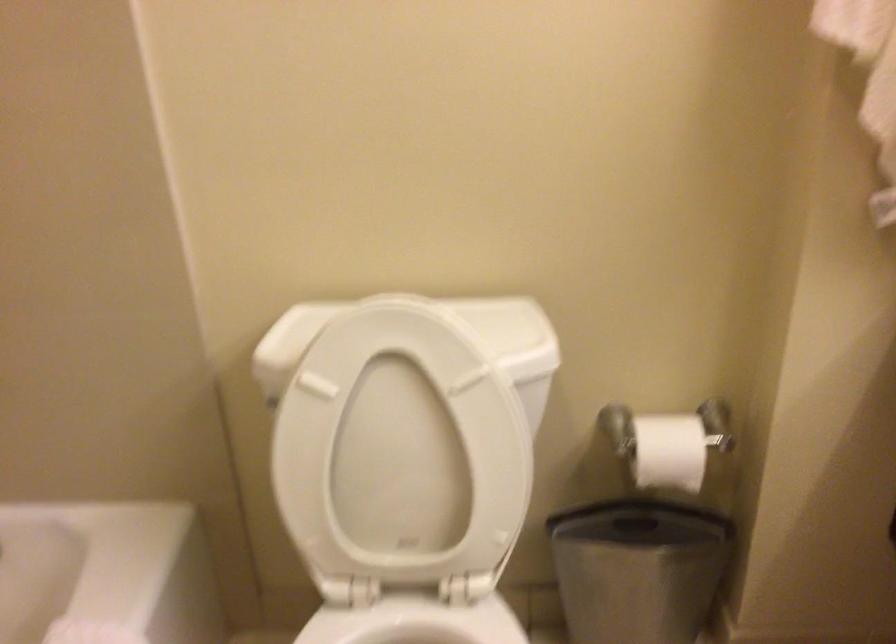
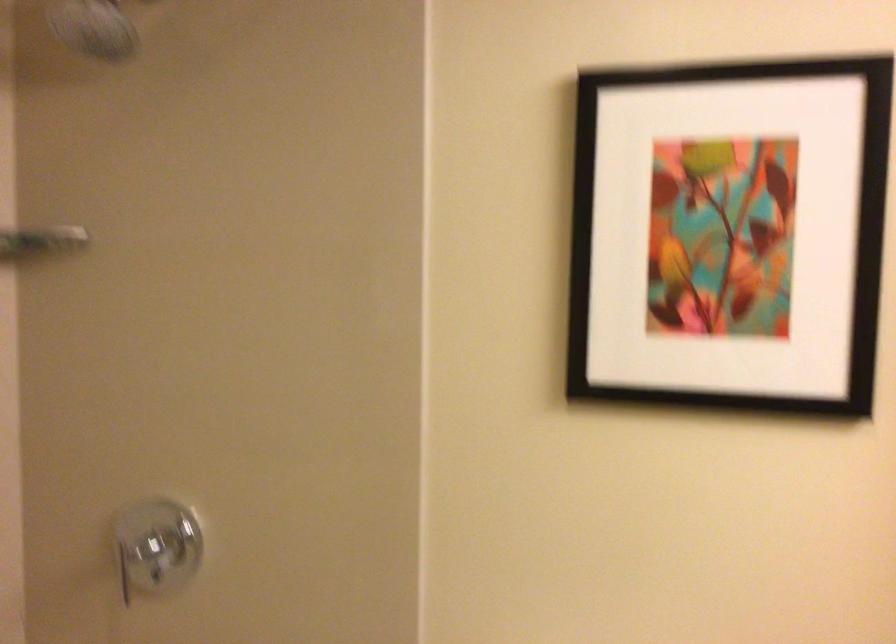
Which direction would the cameraman need to move to produce the second image?

The movement direction of the cameraman is left, backward.